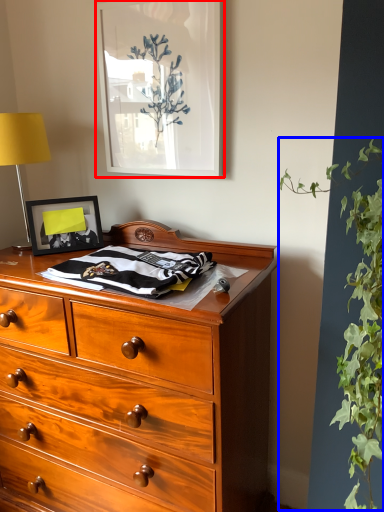
Question: Which of the following is the closest to the observer, picture frame (highlighted by a red box) or vegetation (highlighted by a blue box)?

Choices:
 (A) picture frame
 (B) vegetation

Answer: (B)